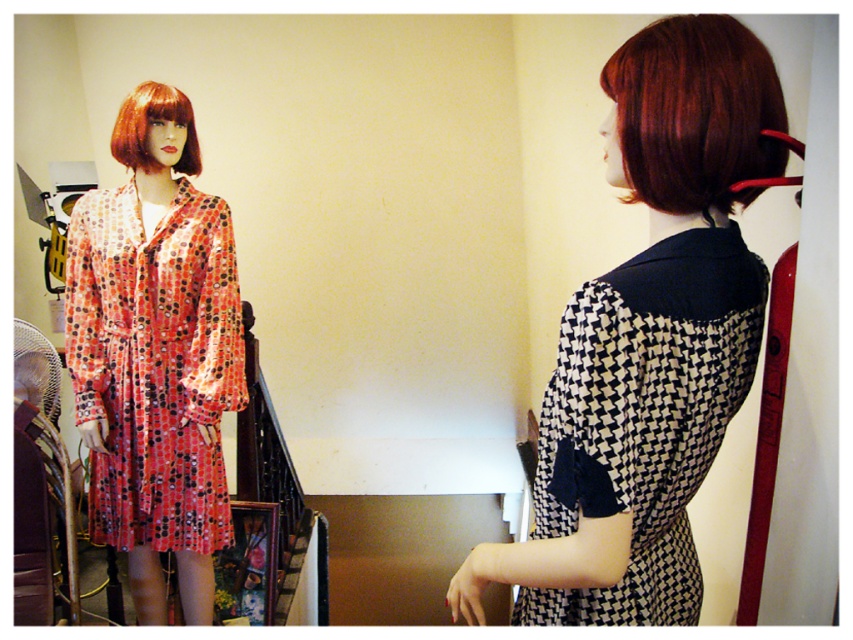
Question: Estimate the real-world distances between objects in this image. Which object is closer to the shiny red hair at upper right?

Choices:
 (A) polka dot silk dress at left
 (B) blonde synthetic wig at upper left
 (C) black and white checkered dress at right
 (D) black and white checkered dress at center

Answer: (C)

Question: Which point appears closest to the camera in this image?

Choices:
 (A) (728, 38)
 (B) (112, 147)

Answer: (A)

Question: Which object is farther from the camera taking this photo?

Choices:
 (A) black and white checkered dress at center
 (B) polka dot silk dress at left
 (C) blonde synthetic wig at upper left

Answer: (B)

Question: Is black and white checkered dress at center positioned in front of blonde synthetic wig at upper left?

Choices:
 (A) yes
 (B) no

Answer: (A)

Question: Does polka dot silk dress at left appear on the right side of blonde synthetic wig at upper left?

Choices:
 (A) yes
 (B) no

Answer: (B)

Question: Is shiny red hair at upper right positioned in front of blonde synthetic wig at upper left?

Choices:
 (A) no
 (B) yes

Answer: (B)